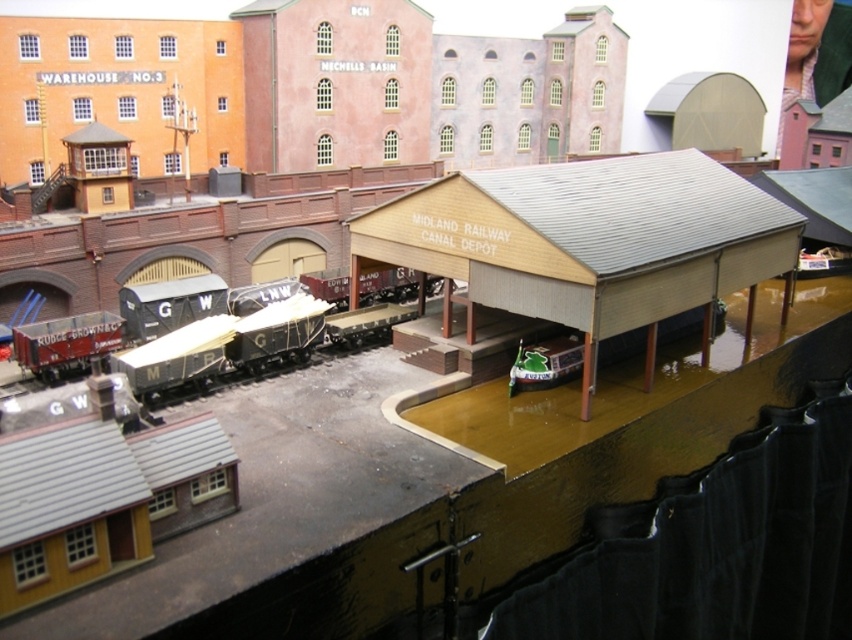
Looking at this image, does wooden/metal roofed shed at center appear on the right side of matte black train car at center?

Correct, you'll find wooden/metal roofed shed at center to the right of matte black train car at center.

The width and height of the screenshot is (852, 640). Identify the location of wooden/metal roofed shed at center. (588, 243).

Is wooden/metal roofed shed at center smaller than green plastic boat at lower center?

No.

From the picture: Can you confirm if wooden/metal roofed shed at center is taller than green plastic boat at lower center?

Indeed, wooden/metal roofed shed at center has a greater height compared to green plastic boat at lower center.

Who is more forward, (781,248) or (553,374)?

Point (553,374) is in front.

Find the location of a particular element. wooden/metal roofed shed at center is located at coordinates (588, 243).

Is matte black train car at center above green plastic boat at lower center?

Yes, matte black train car at center is above green plastic boat at lower center.

Where is `matte black train car at center`? The height and width of the screenshot is (640, 852). matte black train car at center is located at coordinates (188, 323).